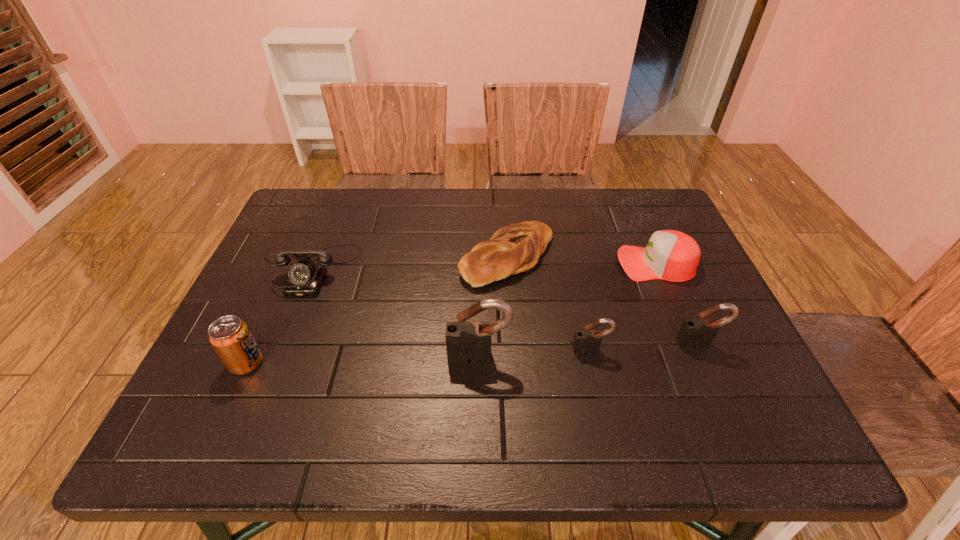
You are a GUI agent. You are given a task and a screenshot of the screen. Output one action in this format:
    pyautogui.click(x=<x>, y=<y>)
    Task: Click on the leftmost padlock
    The image size is (960, 540).
    Given the screenshot: What is the action you would take?
    pyautogui.click(x=468, y=342)

Find the location of a particular element. This screenshot has width=960, height=540. the tallest object is located at coordinates (468, 342).

Locate an element on the screen. the second padlock from right to left is located at coordinates (586, 341).

At what (x,y) coordinates should I click in order to perform the action: click on the fifth object from left to right. Please return your answer as a coordinate pair (x, y). The height and width of the screenshot is (540, 960). Looking at the image, I should click on (586, 341).

Image resolution: width=960 pixels, height=540 pixels. Identify the location of the second shortest padlock. (699, 332).

Locate an element on the screen. The height and width of the screenshot is (540, 960). baseball cap is located at coordinates (670, 255).

Find the location of `the shortest object`. the shortest object is located at coordinates (516, 248).

Where is `telephone`? This screenshot has height=540, width=960. telephone is located at coordinates tap(305, 278).

Locate an element on the screen. The height and width of the screenshot is (540, 960). soda can is located at coordinates (230, 337).

You are a GUI agent. You are given a task and a screenshot of the screen. Output one action in this format:
    pyautogui.click(x=<x>, y=<y>)
    Task: Click on the free space located 0.060m with the keyhole on the front of the tallest padlock
    
    Given the screenshot: What is the action you would take?
    pyautogui.click(x=479, y=389)